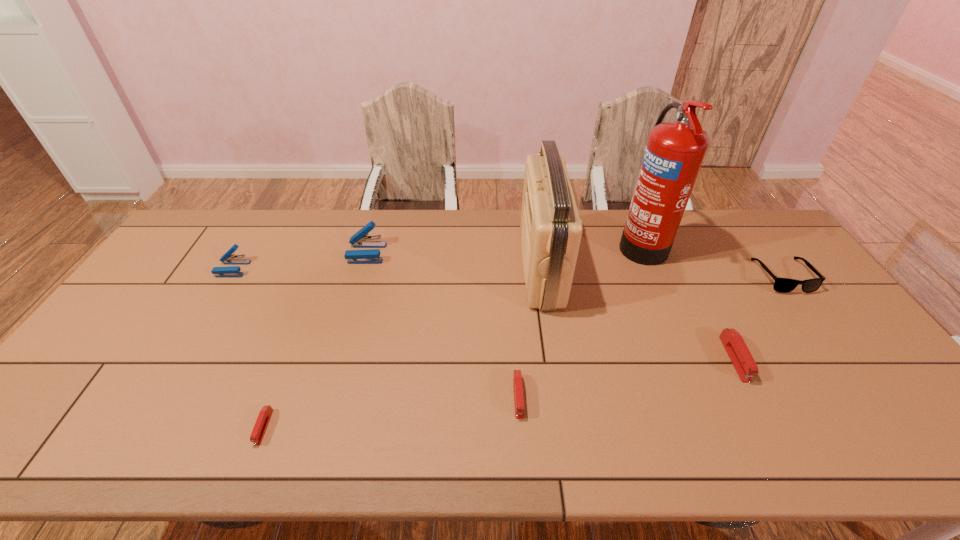
I want to click on vacant point that satisfies the following two spatial constraints: 1. on the surface of the red fire extinguisher; 2. on the front-facing side of the leftmost red stapler, so point(719,427).